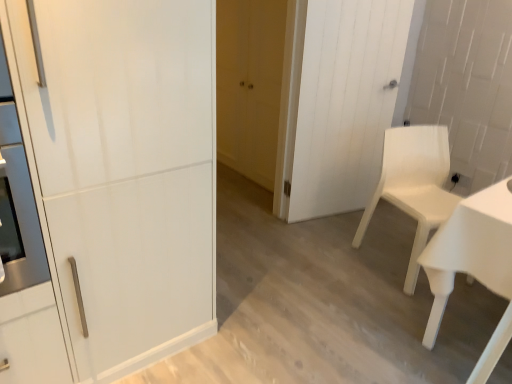
Where is `white glossy cabinet at left, which is the first door in left-to-right order`? The height and width of the screenshot is (384, 512). white glossy cabinet at left, which is the first door in left-to-right order is located at coordinates (123, 170).

Measure the distance between point (370,126) and camera.

They are 2.95 meters apart.

Locate an element on the screen. The height and width of the screenshot is (384, 512). white plastic chair at right is located at coordinates click(x=414, y=185).

You are a GUI agent. You are given a task and a screenshot of the screen. Output one action in this format:
    pyautogui.click(x=<x>, y=<y>)
    Task: Click on the white glossy cabinet at left, the third door in the right-to-left sequence
    The width and height of the screenshot is (512, 384).
    Given the screenshot: What is the action you would take?
    pyautogui.click(x=123, y=170)

Could you measure the distance between white wood door at center, the 1th door when ordered from right to left, and matte yellow door at center, which ranks as the second door in left-to-right order?

23.57 inches.

How different are the orientations of white wood door at center, the 3th door positioned from the left, and matte yellow door at center, which appears as the 1th door when viewed from the back, in degrees?

72.7 degrees separate the facing orientations of white wood door at center, the 3th door positioned from the left, and matte yellow door at center, which appears as the 1th door when viewed from the back.

Can you confirm if white wood door at center, arranged as the second door when viewed from the front, is wider than matte yellow door at center, which is the 2th door from right to left?

Indeed, white wood door at center, arranged as the second door when viewed from the front, has a greater width compared to matte yellow door at center, which is the 2th door from right to left.

Is white wood door at center, the 1th door when ordered from right to left, looking in the opposite direction of matte yellow door at center, which is the 2th door from right to left?

Yes, white wood door at center, the 1th door when ordered from right to left, is positioned with its back facing matte yellow door at center, which is the 2th door from right to left.

Considering the sizes of white glossy cabinet at left, which is the first door in front-to-back order, and white wood door at center, the 3th door positioned from the left, in the image, is white glossy cabinet at left, which is the first door in front-to-back order, wider or thinner than white wood door at center, the 3th door positioned from the left,?

In the image, white glossy cabinet at left, which is the first door in front-to-back order, appears to be wider than white wood door at center, the 3th door positioned from the left.

Considering the relative sizes of white glossy cabinet at left, which is the first door in front-to-back order, and white wood door at center, arranged as the second door when viewed from the front, in the image provided, is white glossy cabinet at left, which is the first door in front-to-back order, smaller than white wood door at center, arranged as the second door when viewed from the front,?

Actually, white glossy cabinet at left, which is the first door in front-to-back order, might be larger than white wood door at center, arranged as the second door when viewed from the front.

Is white glossy cabinet at left, which is the first door in front-to-back order, looking in the opposite direction of white wood door at center, arranged as the second door when viewed from the front?

That's not correct — white glossy cabinet at left, which is the first door in front-to-back order, is not looking away from white wood door at center, arranged as the second door when viewed from the front.

Who is shorter, white glossy cabinet at left, arranged as the third door when viewed from the back, or white wood door at center, arranged as the second door when viewed from the front?

With less height is white wood door at center, arranged as the second door when viewed from the front.

From the image's perspective, which one is positioned higher, white glossy cabinet at left, arranged as the third door when viewed from the back, or white plastic chair at right?

white glossy cabinet at left, arranged as the third door when viewed from the back, from the image's perspective.

Is white glossy cabinet at left, which is the first door in left-to-right order, far from white plastic chair at right?

white glossy cabinet at left, which is the first door in left-to-right order, is far away from white plastic chair at right.

Which point is more forward, [155,41] or [425,210]?

Point [155,41]

From the image's perspective, is matte yellow door at center, which is the 2th door from right to left, positioned above or below white glossy cabinet at left, arranged as the third door when viewed from the back?

matte yellow door at center, which is the 2th door from right to left, is situated higher than white glossy cabinet at left, arranged as the third door when viewed from the back, in the image.

Is matte yellow door at center, which appears as the 1th door when viewed from the back, not near white glossy cabinet at left, which is the first door in left-to-right order?

That's right, there is a large distance between matte yellow door at center, which appears as the 1th door when viewed from the back, and white glossy cabinet at left, which is the first door in left-to-right order.

Does matte yellow door at center, arranged as the 3th door when viewed from the front, lie behind white glossy cabinet at left, the third door in the right-to-left sequence?

Yes, it is.

Where is `the 2nd door behind the white glossy cabinet at left, the third door in the right-to-left sequence`? Image resolution: width=512 pixels, height=384 pixels. the 2nd door behind the white glossy cabinet at left, the third door in the right-to-left sequence is located at coordinates (249, 85).

Which object is wider, white plastic chair at right or matte yellow door at center, arranged as the 3th door when viewed from the front?

Wider between the two is white plastic chair at right.

Is matte yellow door at center, which ranks as the second door in left-to-right order, completely or partially inside white plastic chair at right?

No, matte yellow door at center, which ranks as the second door in left-to-right order, is not surrounded by white plastic chair at right.

Looking at this image, does white plastic chair at right lie behind matte yellow door at center, which is the 2th door from right to left?

That is False.

Could you measure the distance between white plastic chair at right and matte yellow door at center, arranged as the 3th door when viewed from the front?

They are 3.72 feet apart.

Would you say white wood door at center, arranged as the second door when viewed from the front, is a long distance from white glossy cabinet at left, arranged as the third door when viewed from the back?

That's right, there is a large distance between white wood door at center, arranged as the second door when viewed from the front, and white glossy cabinet at left, arranged as the third door when viewed from the back.

Where is `the 1st door positioned below the white wood door at center, the second door when ordered from back to front (from a real-world perspective)`? the 1st door positioned below the white wood door at center, the second door when ordered from back to front (from a real-world perspective) is located at coordinates (123, 170).

Is white wood door at center, arranged as the second door when viewed from the front, shorter than white glossy cabinet at left, which is the first door in left-to-right order?

Yes, white wood door at center, arranged as the second door when viewed from the front, is shorter than white glossy cabinet at left, which is the first door in left-to-right order.

From a real-world perspective, which object rests below the other?

white plastic chair at right.

Is point (418, 234) farther from camera compared to point (129, 288)?

Yes, point (418, 234) is farther from viewer.

Is white plastic chair at right beside white glossy cabinet at left, which is the first door in front-to-back order?

No.

Consider the image. From the image's perspective, is white plastic chair at right on white glossy cabinet at left, the third door in the right-to-left sequence?

No.

Identify the location of door that is the 2nd one below the white wood door at center, arranged as the second door when viewed from the front (from a real-world perspective). (249, 85).

Where is `the 1st door above the white glossy cabinet at left, arranged as the third door when viewed from the back (from the image's perspective)`? the 1st door above the white glossy cabinet at left, arranged as the third door when viewed from the back (from the image's perspective) is located at coordinates (340, 101).

From the image, which object appears to be nearer to matte yellow door at center, which appears as the 1th door when viewed from the back, white plastic chair at right or white glossy cabinet at left, which is the first door in front-to-back order?

Based on the image, white plastic chair at right appears to be nearer to matte yellow door at center, which appears as the 1th door when viewed from the back.

When comparing their distances from white wood door at center, the second door when ordered from back to front, does white glossy cabinet at left, the third door in the right-to-left sequence, or white plastic chair at right seem closer?

white plastic chair at right lies closer to white wood door at center, the second door when ordered from back to front, than the other object.

Looking at the image, which one is located closer to white plastic chair at right, matte yellow door at center, which is the 2th door from right to left, or white wood door at center, the 1th door when ordered from right to left?

Based on the image, white wood door at center, the 1th door when ordered from right to left, appears to be nearer to white plastic chair at right.

Considering their positions, is white wood door at center, arranged as the second door when viewed from the front, positioned further to white plastic chair at right than white glossy cabinet at left, which is the first door in front-to-back order?

white glossy cabinet at left, which is the first door in front-to-back order, is positioned further to the anchor white plastic chair at right.

Based on their spatial positions, is white plastic chair at right or white wood door at center, the 1th door when ordered from right to left, closer to matte yellow door at center, which ranks as the second door in left-to-right order?

white wood door at center, the 1th door when ordered from right to left, is positioned closer to the anchor matte yellow door at center, which ranks as the second door in left-to-right order.

Estimate the real-world distances between objects in this image. Which object is closer to white glossy cabinet at left, the third door in the right-to-left sequence, white plastic chair at right or white wood door at center, the 1th door when ordered from right to left?

The object closer to white glossy cabinet at left, the third door in the right-to-left sequence, is white plastic chair at right.

Considering their positions, is white glossy cabinet at left, which is the first door in front-to-back order, positioned closer to matte yellow door at center, which appears as the 1th door when viewed from the back, than white plastic chair at right?

white plastic chair at right is positioned closer to the anchor matte yellow door at center, which appears as the 1th door when viewed from the back.

Considering their positions, is white wood door at center, the second door when ordered from back to front, positioned further to matte yellow door at center, which appears as the 1th door when viewed from the back, than white plastic chair at right?

Based on the image, white plastic chair at right appears to be further to matte yellow door at center, which appears as the 1th door when viewed from the back.

The height and width of the screenshot is (384, 512). Identify the location of door between white glossy cabinet at left, which is the first door in front-to-back order, and matte yellow door at center, which appears as the 1th door when viewed from the back, along the z-axis. (340, 101).

The image size is (512, 384). In order to click on door between matte yellow door at center, which is the 2th door from right to left, and white plastic chair at right from left to right in this screenshot , I will do `click(340, 101)`.

Locate an element on the screen. chair positioned between white glossy cabinet at left, the third door in the right-to-left sequence, and matte yellow door at center, which appears as the 1th door when viewed from the back, from near to far is located at coordinates (414, 185).